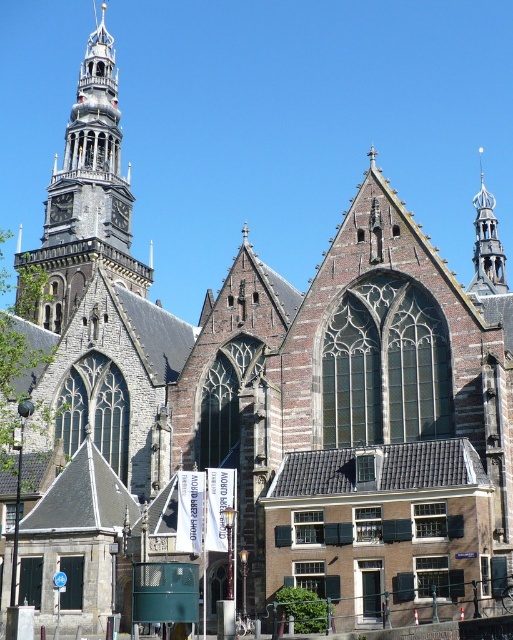
Can you confirm if brown stone tower at upper left is bigger than polished brass spire at upper right?

Correct, brown stone tower at upper left is larger in size than polished brass spire at upper right.

Which is behind, point (88, 198) or point (504, 268)?

The point (88, 198) is more distant.

Who is more forward, (126, 284) or (479, 148)?

Point (126, 284) is in front.

You are a GUI agent. You are given a task and a screenshot of the screen. Output one action in this format:
    pyautogui.click(x=<x>, y=<y>)
    Task: Click on the brown stone tower at upper left
    
    Given the screenshot: What is the action you would take?
    pyautogui.click(x=88, y=195)